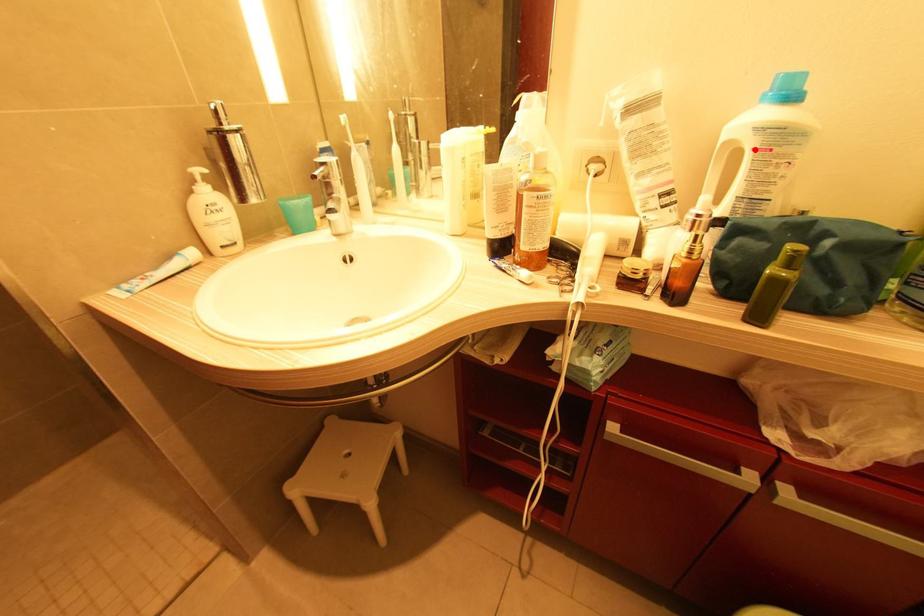
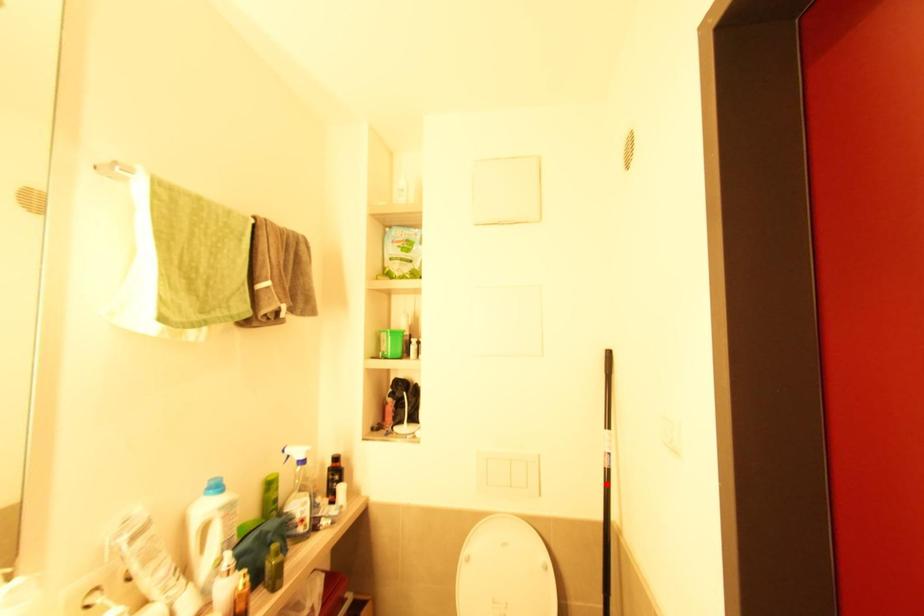
I am providing you with two images of the same scene from different viewpoints. A red point is marked on the first image and another point is marked on the second image. Is the red point in image1 aligned with the point shown in image2?

No